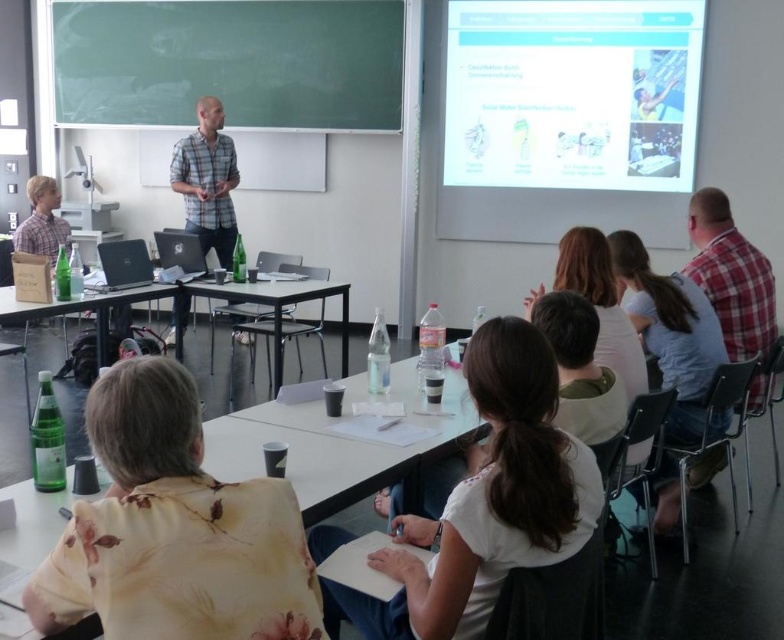
Question: Can you confirm if plaid cotton shirt at center is smaller than clear plastic table at lower left?

Choices:
 (A) no
 (B) yes

Answer: (B)

Question: Among these objects, which one is nearest to the camera?

Choices:
 (A) plaid cotton shirt at center
 (B) white glossy projection screen at upper right
 (C) clear plastic table at lower left

Answer: (C)

Question: Which object is positioned farthest from the clear plastic table at lower left?

Choices:
 (A) white plastic table at lower center
 (B) green chalkboard at upper left
 (C) plaid cotton shirt at center

Answer: (B)

Question: Can you confirm if white glossy projection screen at upper right is positioned above white plastic table at center?

Choices:
 (A) yes
 (B) no

Answer: (A)

Question: Can you confirm if white glossy projection screen at upper right is positioned below plaid cotton shirt at center?

Choices:
 (A) no
 (B) yes

Answer: (A)

Question: Which point appears closest to the camera in this image?

Choices:
 (A) (241, 298)
 (B) (495, 99)
 (C) (106, 337)

Answer: (A)